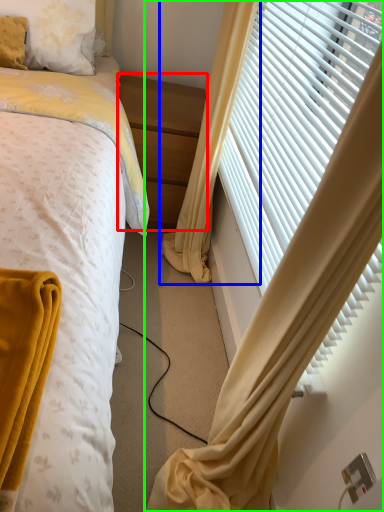
Question: Which is nearer to the nightstand (highlighted by a red box)? curtain (highlighted by a blue box) or curtain (highlighted by a green box).

Choices:
 (A) curtain
 (B) curtain

Answer: (A)